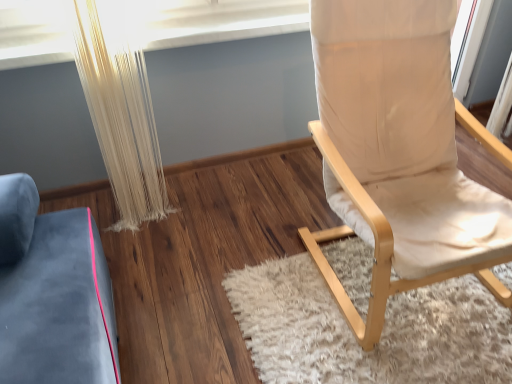
Where is `vacant space to the left of beige fabric chair at right`? This screenshot has height=384, width=512. vacant space to the left of beige fabric chair at right is located at coordinates (206, 257).